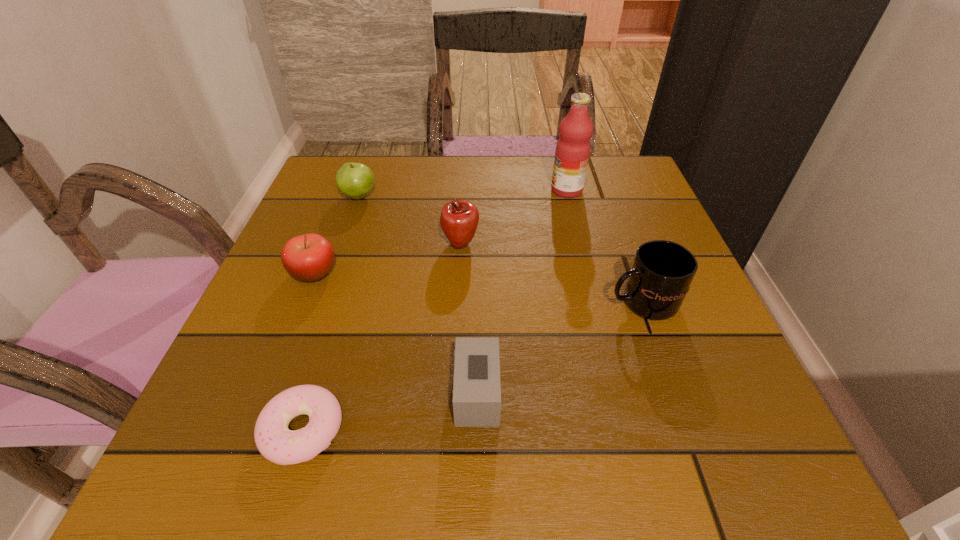
Identify the location of the fifth closest object to the rightmost apple. This screenshot has width=960, height=540. (476, 391).

Locate an element on the screen. the second closest object relative to the fruit juice is located at coordinates (662, 271).

Find the location of a particular element. The height and width of the screenshot is (540, 960). apple that is the third nearest to the alarm clock is located at coordinates (355, 180).

In order to click on apple that is the second nearest to the shortest object in this screenshot , I will do `click(459, 219)`.

Image resolution: width=960 pixels, height=540 pixels. I want to click on free region that satisfies the following two spatial constraints: 1. on the front side of the farthest apple; 2. on the left side of the rightmost apple, so 342,244.